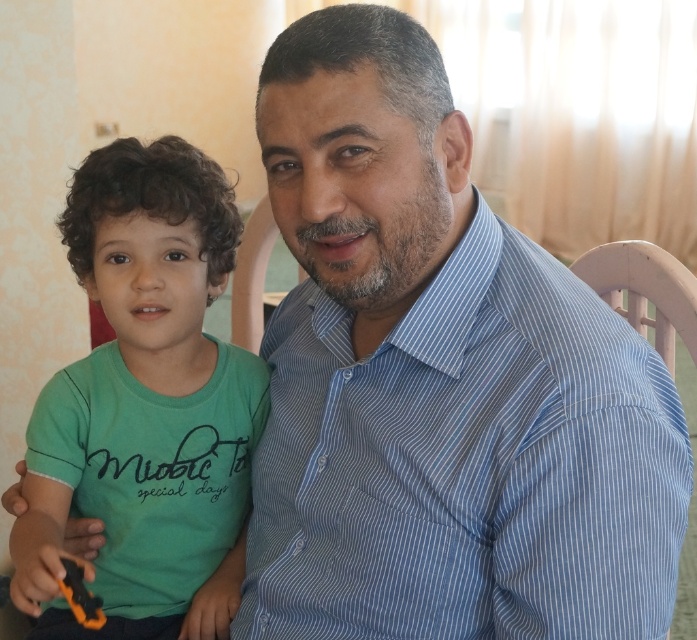
You are a photographer setting up for a family portrait. You notice the blue striped shirt at center and the orange plastic toy at lower left in the scene. Based on their sizes, which object should you adjust your focus to ensure both are clearly visible in the photo?

The blue striped shirt at center is wider than the orange plastic toy at lower left, so you should focus on the blue striped shirt at center since it takes up more space in the frame.

You are standing in front of a family portrait. The image shows an adult male in a light blue shirt and a child in a green T shirt. You need to determine if you can comfortably reach the green matte shirt at left without moving your position. Your arms can extend up to 28 inches. Can you reach it?

The distance between the green matte shirt at left and the viewer is 31.78 inches, which is beyond your arm extension limit of 28 inches. Therefore, you cannot reach the green matte shirt at left without moving.

You are standing in the room where the two people are sitting. You want to place a small decorative item on the point closer to you between the two points labeled point (x=436, y=452) and point (x=95, y=628). Which point should you choose?

You should choose point (x=436, y=452) because it is closer to the viewer than point (x=95, y=628).